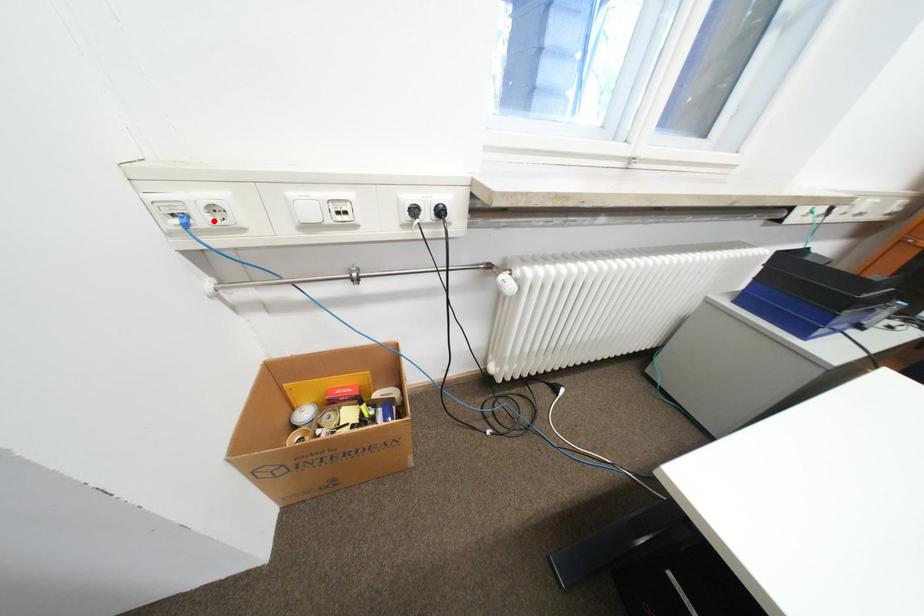
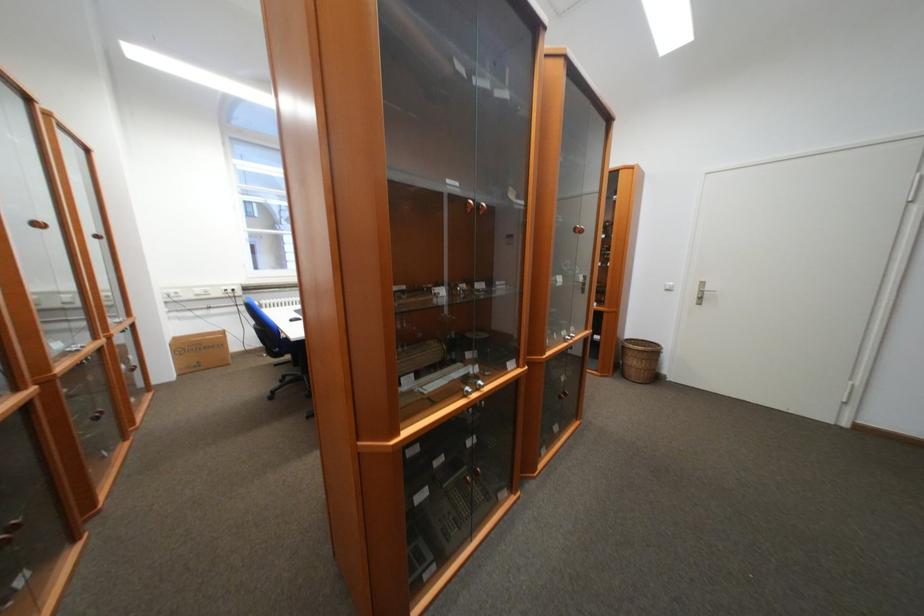
Where in the second image is the point corresponding to the highlighted location from the first image?

(181, 296)